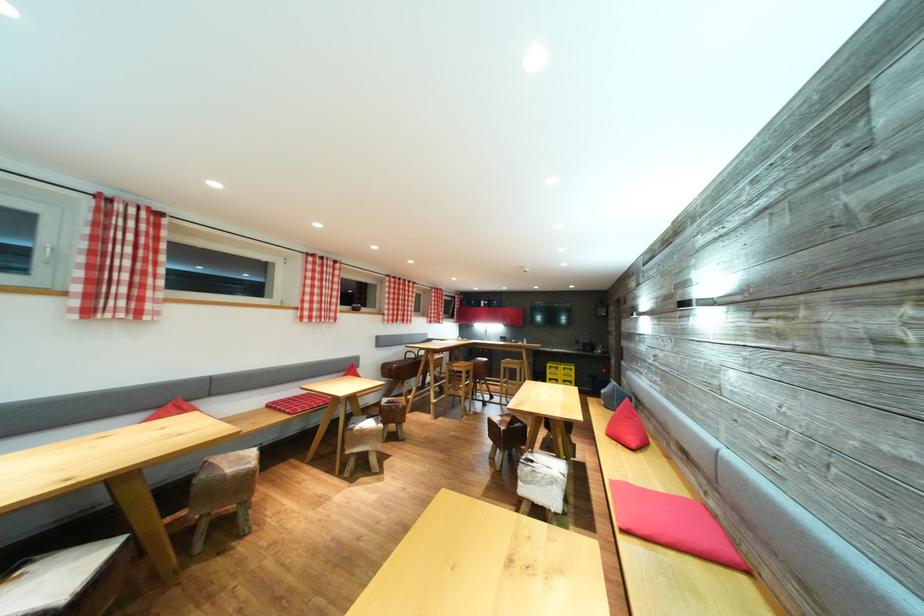
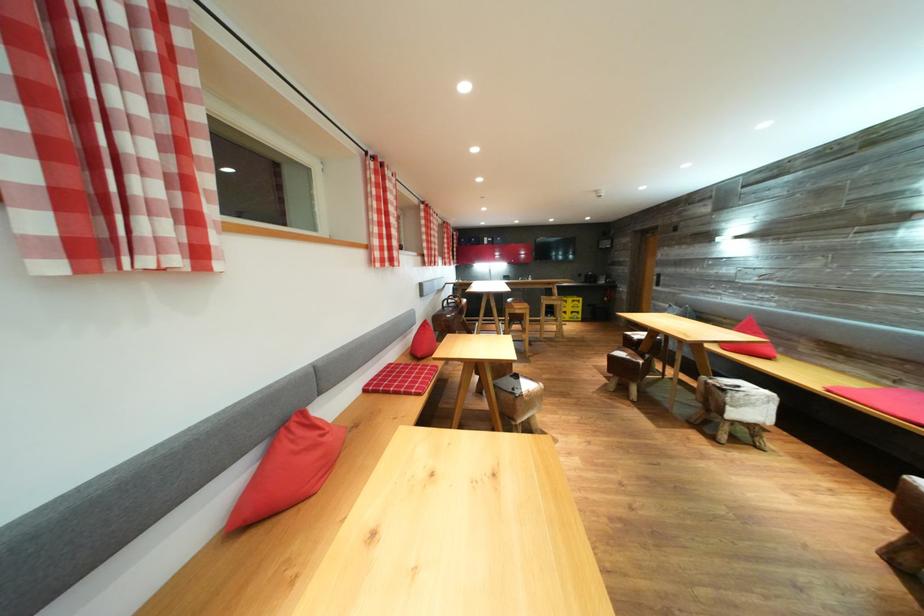
The point at (359, 435) is marked in the first image. Where is the corresponding point in the second image?

(528, 400)